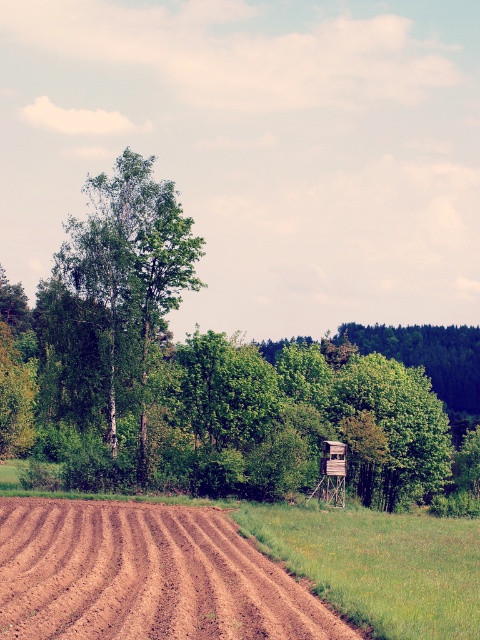
Question: Is brown soil at lower left wider than green leafy tree at center?

Choices:
 (A) no
 (B) yes

Answer: (A)

Question: Among these objects, which one is farthest from the camera?

Choices:
 (A) green leafy tree at center
 (B) brown soil at lower left

Answer: (A)

Question: Can you confirm if brown soil at lower left is positioned to the left of green leafy tree at center?

Choices:
 (A) no
 (B) yes

Answer: (A)

Question: Does brown soil at lower left come in front of green leafy tree at center?

Choices:
 (A) no
 (B) yes

Answer: (B)